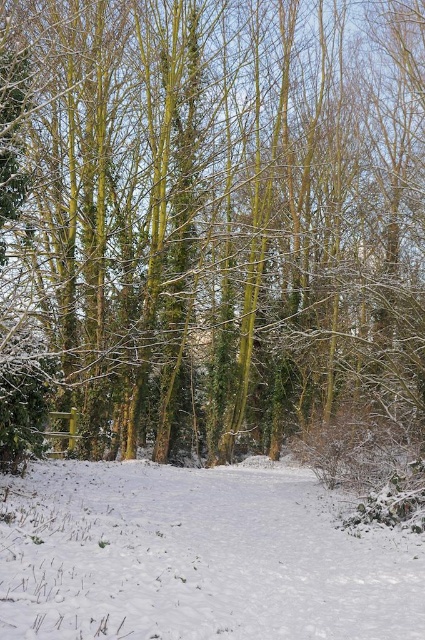
Who is positioned more to the right, snow-covered trees at center or white powdery snow at center?

white powdery snow at center

Who is shorter, snow-covered trees at center or white powdery snow at center?

Standing shorter between the two is white powdery snow at center.

Where is `snow-covered trees at center`? This screenshot has height=640, width=425. snow-covered trees at center is located at coordinates (209, 224).